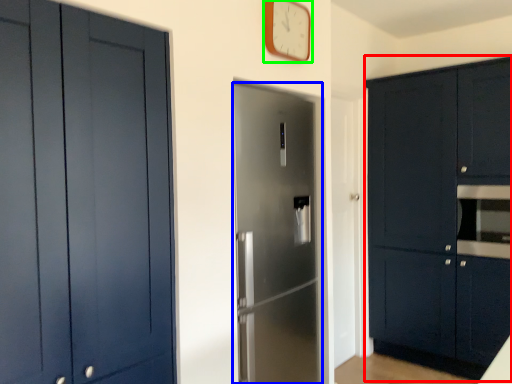
Question: Which object is positioned closest to cabinetry (highlighted by a red box)? Select from door (highlighted by a blue box) and clock (highlighted by a green box).

Choices:
 (A) door
 (B) clock

Answer: (A)